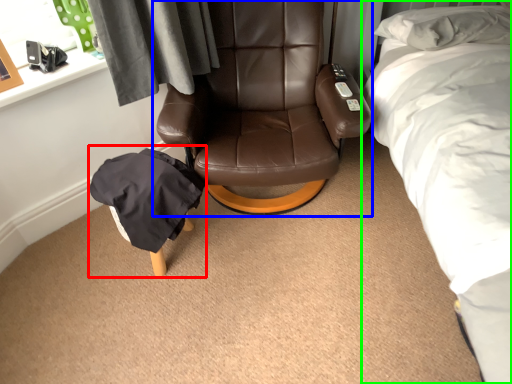
Question: Based on their relative distances, which object is nearer to bean bag chair (highlighted by a red box)? Choose from chair (highlighted by a blue box) and bed (highlighted by a green box).

Choices:
 (A) chair
 (B) bed

Answer: (A)